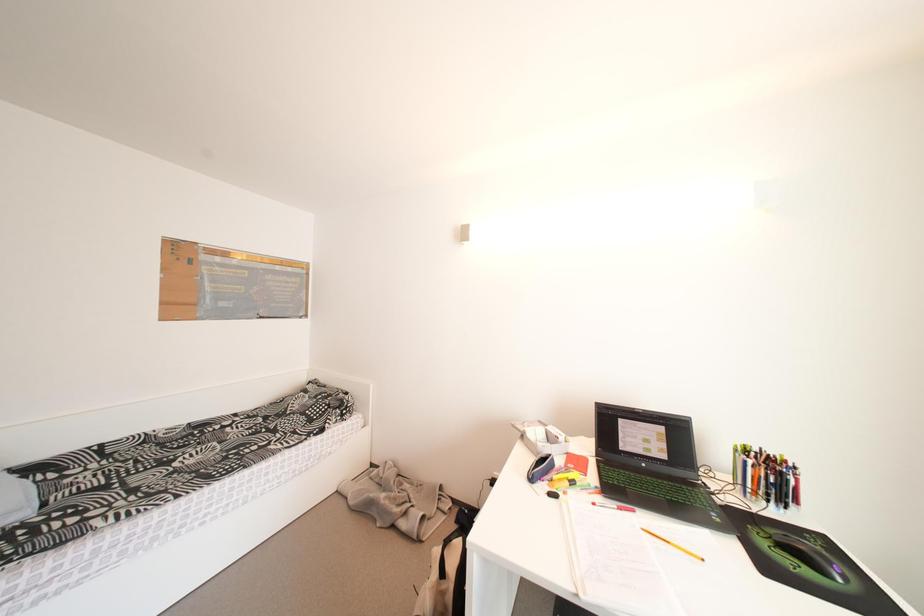
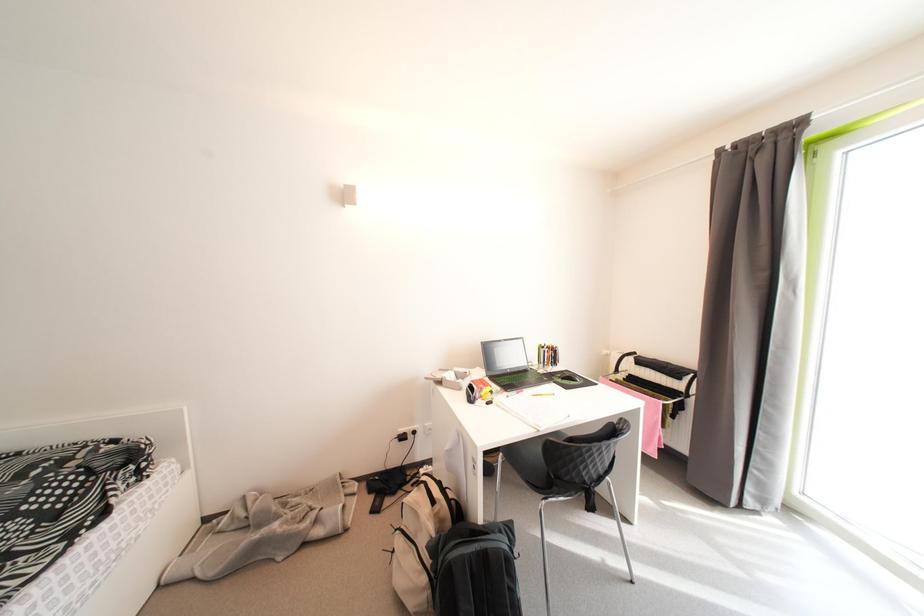
Question: Based on the continuous images, in which direction is the camera rotating? Reply with the corresponding letter.

Choices:
 (A) Left
 (B) Right
 (C) Up
 (D) Down

Answer: (B)